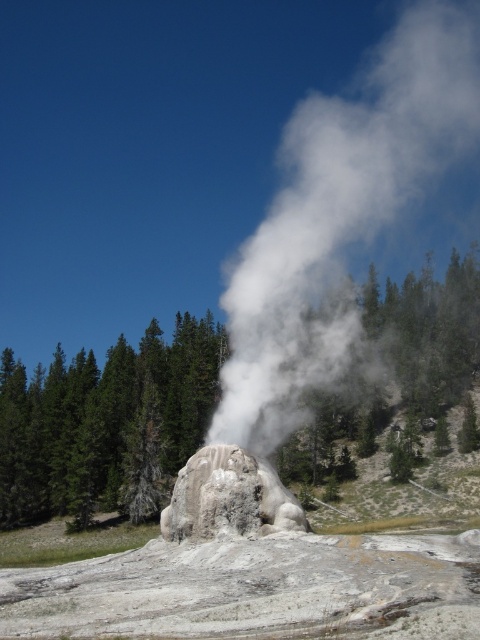
How distant is white vapor at center from gray stone geyser at center?

white vapor at center and gray stone geyser at center are 41.59 meters apart from each other.

Describe the element at coordinates (339, 218) in the screenshot. I see `white vapor at center` at that location.

Identify the location of white vapor at center. (339, 218).

Is point (396, 368) more distant than point (208, 515)?

That is True.

Is green textured tree at center wider than gray stone geyser at center?

Indeed, green textured tree at center has a greater width compared to gray stone geyser at center.

Does point (3, 497) come farther from viewer compared to point (264, 477)?

Yes.

What are the coordinates of `green textured tree at center` in the screenshot? It's located at (106, 424).

Is green textured tree at center behind white vapor at center?

That is True.

Is point (96, 406) in front of point (333, 296)?

Yes, point (96, 406) is in front of point (333, 296).

Does point (13, 481) come farther from viewer compared to point (340, 342)?

No, it is not.

Where is `green textured tree at center`? green textured tree at center is located at coordinates (106, 424).